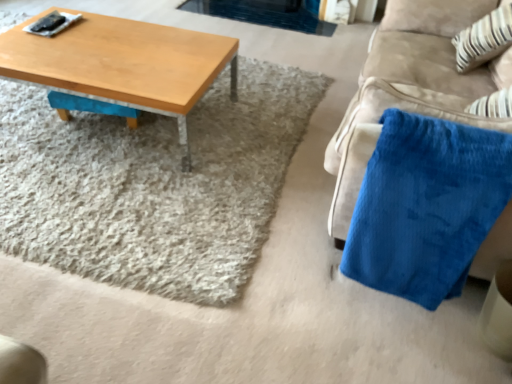
Question: Considering the relative sizes of white striped fabric at upper right and light brown wood coffee table at upper left in the image provided, is white striped fabric at upper right shorter than light brown wood coffee table at upper left?

Choices:
 (A) yes
 (B) no

Answer: (B)

Question: Is white striped fabric at upper right looking in the opposite direction of light brown wood coffee table at upper left?

Choices:
 (A) no
 (B) yes

Answer: (A)

Question: Is white striped fabric at upper right wider than light brown wood coffee table at upper left?

Choices:
 (A) no
 (B) yes

Answer: (A)

Question: Are white striped fabric at upper right and light brown wood coffee table at upper left far apart?

Choices:
 (A) yes
 (B) no

Answer: (A)

Question: Can you confirm if white striped fabric at upper right is positioned to the left of light brown wood coffee table at upper left?

Choices:
 (A) yes
 (B) no

Answer: (B)

Question: Does white striped fabric at upper right have a larger size compared to light brown wood coffee table at upper left?

Choices:
 (A) no
 (B) yes

Answer: (A)

Question: Is the surface of light brown wood coffee table at upper left in direct contact with white striped fabric at upper right?

Choices:
 (A) yes
 (B) no

Answer: (B)

Question: Does light brown wood coffee table at upper left have a greater width compared to white striped fabric at upper right?

Choices:
 (A) yes
 (B) no

Answer: (A)

Question: Is light brown wood coffee table at upper left to the left of white striped fabric at upper right from the viewer's perspective?

Choices:
 (A) yes
 (B) no

Answer: (A)

Question: Considering the relative positions of light brown wood coffee table at upper left and white striped fabric at upper right in the image provided, is light brown wood coffee table at upper left to the right of white striped fabric at upper right from the viewer's perspective?

Choices:
 (A) yes
 (B) no

Answer: (B)

Question: Would you say light brown wood coffee table at upper left is outside white striped fabric at upper right?

Choices:
 (A) yes
 (B) no

Answer: (A)

Question: From the image's perspective, is light brown wood coffee table at upper left beneath white striped fabric at upper right?

Choices:
 (A) no
 (B) yes

Answer: (B)

Question: Can you confirm if light brown wood coffee table at upper left is positioned to the right of velvety blue blanket at right?

Choices:
 (A) no
 (B) yes

Answer: (A)